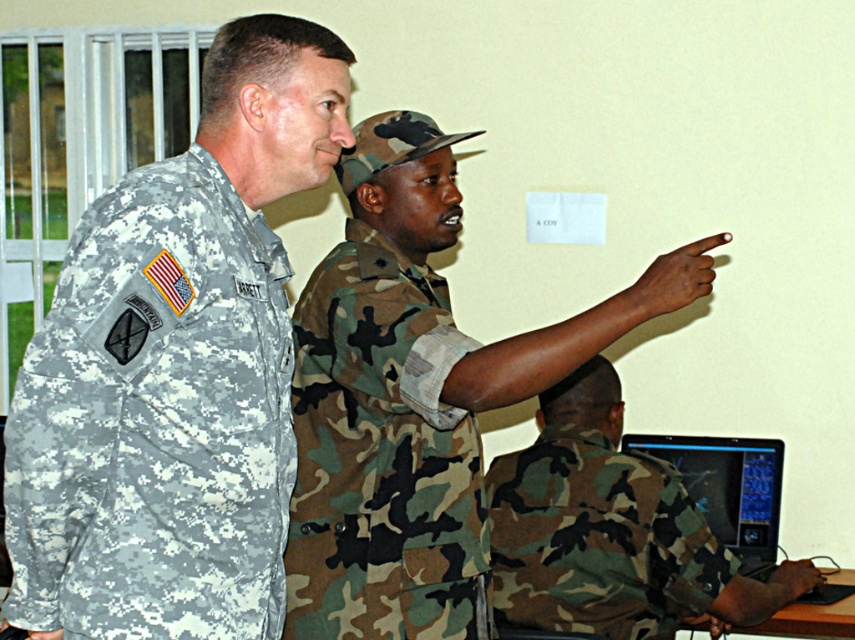
Between camo uniform at lower right and wooden table at lower right, which one appears on the right side from the viewer's perspective?

Positioned to the right is wooden table at lower right.

Describe the element at coordinates (611, 531) in the screenshot. This screenshot has height=640, width=855. I see `camo uniform at lower right` at that location.

Identify the location of camo uniform at lower right. The height and width of the screenshot is (640, 855). click(611, 531).

What are the coordinates of `camo fabric uniform at center` in the screenshot? It's located at (382, 456).

The image size is (855, 640). What do you see at coordinates (382, 456) in the screenshot? I see `camo fabric uniform at center` at bounding box center [382, 456].

Find the location of a particular element. This screenshot has height=640, width=855. camo fabric uniform at center is located at coordinates (382, 456).

Is black glossy monitor at lower right wider than wooden table at lower right?

Incorrect, black glossy monitor at lower right's width does not surpass wooden table at lower right's.

The image size is (855, 640). In order to click on black glossy monitor at lower right in this screenshot , I will do `click(727, 486)`.

Find the location of a particular element. The height and width of the screenshot is (640, 855). black glossy monitor at lower right is located at coordinates (727, 486).